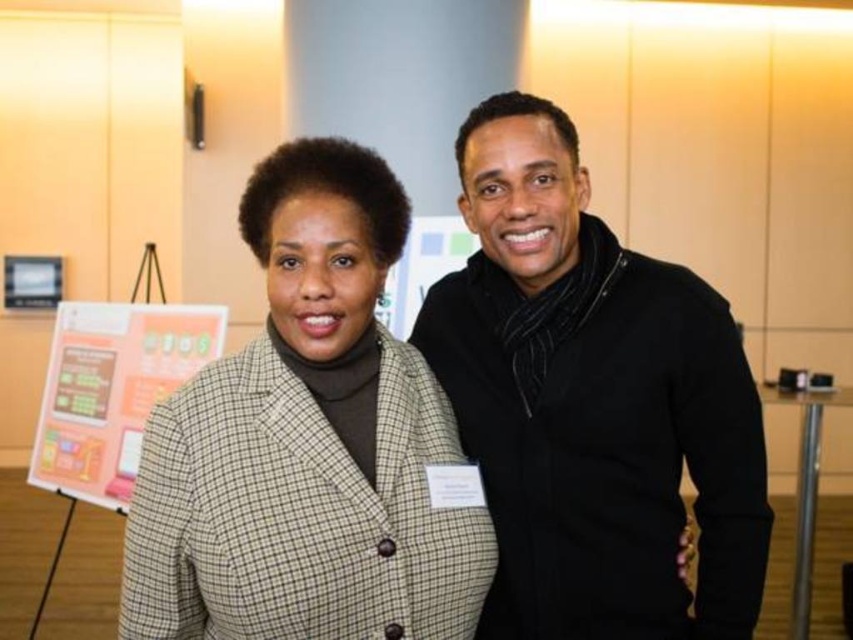
Question: Does black matte sweater at center appear under checkered wool blazer at center?

Choices:
 (A) no
 (B) yes

Answer: (A)

Question: Is black matte sweater at center smaller than orange paperboard at left?

Choices:
 (A) yes
 (B) no

Answer: (A)

Question: Which point is closer to the camera?

Choices:
 (A) (64, 465)
 (B) (505, 154)

Answer: (B)

Question: Which of the following is the farthest from the observer?

Choices:
 (A) (514, 522)
 (B) (283, 362)
 (C) (61, 353)

Answer: (C)

Question: Is black matte sweater at center further to the viewer compared to orange paperboard at left?

Choices:
 (A) yes
 (B) no

Answer: (B)

Question: Among these objects, which one is nearest to the camera?

Choices:
 (A) checkered wool blazer at center
 (B) black matte sweater at center

Answer: (A)